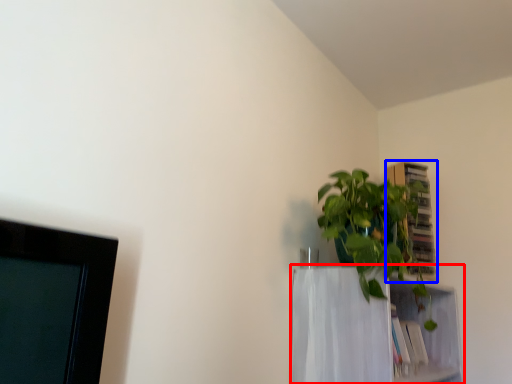
Question: Which object appears farthest to the camera in this image, shelf (highlighted by a red box) or cabinet (highlighted by a blue box)?

Choices:
 (A) shelf
 (B) cabinet

Answer: (B)